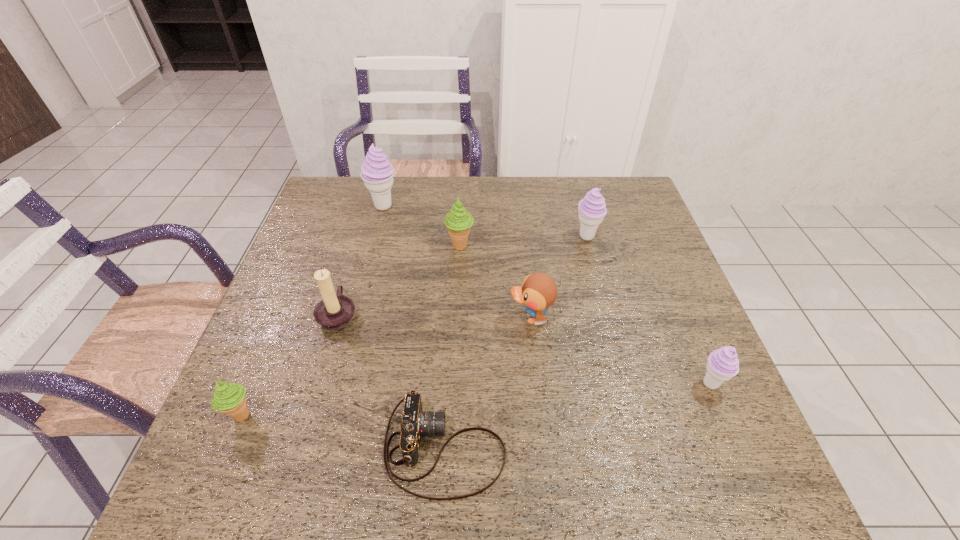
At what (x,y) coordinates should I click in order to perform the action: click on the tallest icecream. Please return your answer as a coordinate pair (x, y). The width and height of the screenshot is (960, 540). Looking at the image, I should click on (377, 173).

Find the location of a particular element. the farthest icecream is located at coordinates (377, 173).

Locate an element on the screen. the seventh object from left to right is located at coordinates (592, 209).

In order to click on the second icecream from right to left in this screenshot , I will do `click(592, 209)`.

At what (x,y) coordinates should I click in order to perform the action: click on the bigger green icecream. Please return your answer as a coordinate pair (x, y). Looking at the image, I should click on (458, 221).

The width and height of the screenshot is (960, 540). In order to click on the right green icecream in this screenshot , I will do [458, 221].

Identify the location of candle holder. The image size is (960, 540). (335, 311).

Locate an element on the screen. The height and width of the screenshot is (540, 960). duck is located at coordinates (538, 291).

This screenshot has width=960, height=540. Find the location of `blue duck`. blue duck is located at coordinates (538, 291).

I want to click on the smaller green icecream, so click(229, 398).